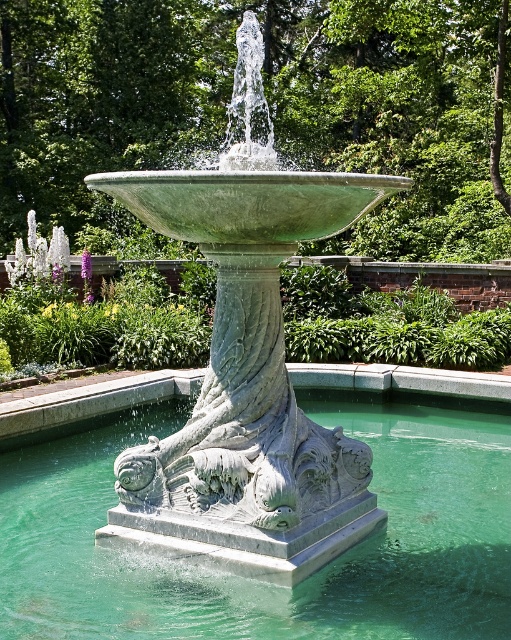
Is point (450, 406) positioned in front of point (229, 406)?

No, (450, 406) is further to viewer.

Is green stone water at center positioned in front of green stone fountain at center?

Yes, it is.

Where is `green stone water at center`? The width and height of the screenshot is (511, 640). green stone water at center is located at coordinates (253, 579).

Identify the location of green stone water at center. Image resolution: width=511 pixels, height=640 pixels. (253, 579).